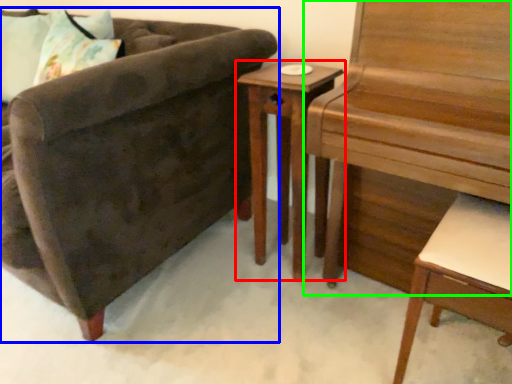
Question: Which is nearer to the nightstand (highlighted by a red box)? chair (highlighted by a blue box) or piano (highlighted by a green box).

Choices:
 (A) chair
 (B) piano

Answer: (B)